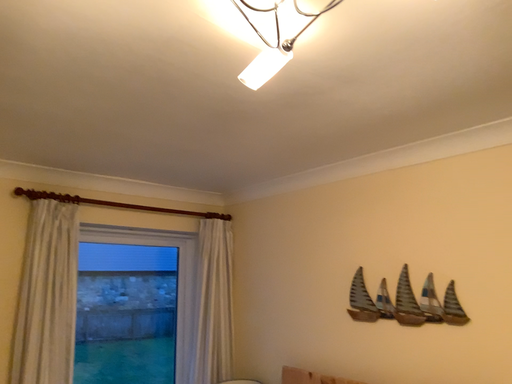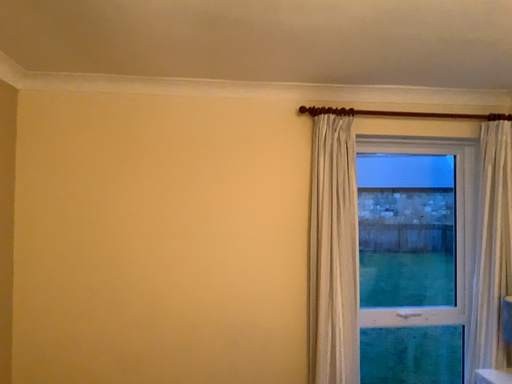
Question: How did the camera likely rotate when shooting the video?

Choices:
 (A) rotated right
 (B) rotated left

Answer: (B)